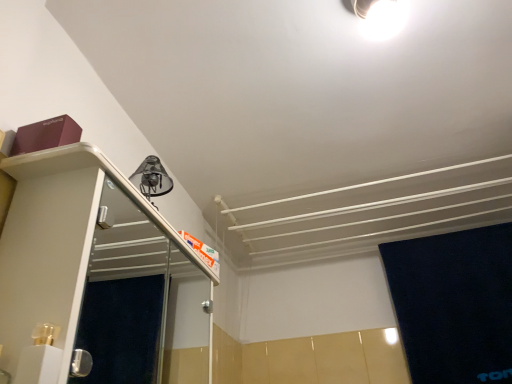
The height and width of the screenshot is (384, 512). I want to click on white glossy screen door at upper left, so click(x=142, y=303).

This screenshot has width=512, height=384. What do you see at coordinates (142, 303) in the screenshot? I see `white glossy screen door at upper left` at bounding box center [142, 303].

Where is `white glossy screen door at upper left`? This screenshot has height=384, width=512. white glossy screen door at upper left is located at coordinates (142, 303).